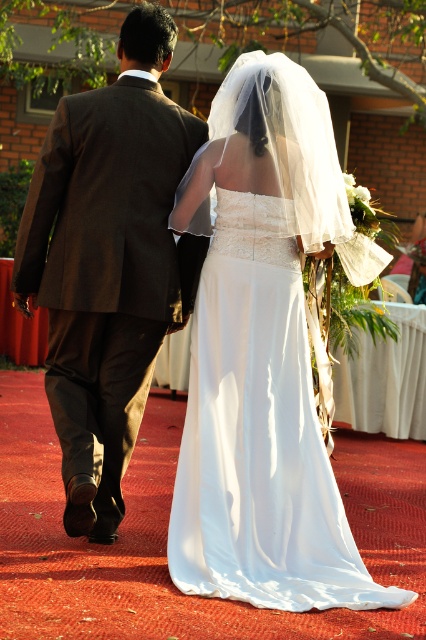
You are a photographer at the wedding. You want to ensure that both the brown wool suit at left and the white satin dress at center are clearly visible in your photo. Given their heights, which one might you need to adjust the camera angle for to capture both effectively?

The brown wool suit at left has a greater height compared to the white satin dress at center. To capture both effectively, you might need to lower the camera angle slightly to ensure the taller brown wool suit at left doesn

You are a photographer at a wedding. You need to decide which object, the brown wool suit at left or the white satin dress at center, requires more space in the frame to capture its full details. Based on their sizes, which one should you focus on first?

The brown wool suit at left is bigger than the white satin dress at center, so you should focus on capturing the brown wool suit at left first to ensure its full details are visible.

You are a photographer standing behind the couple. You need to adjust your camera to focus on both the brown wool suit at left and the white satin dress at center. Can you focus on both subjects at the same time?

The brown wool suit at left and the white satin dress at center are 25.46 inches apart from each other. Since they are close in distance from the camera, the camera can focus on both subjects simultaneously.